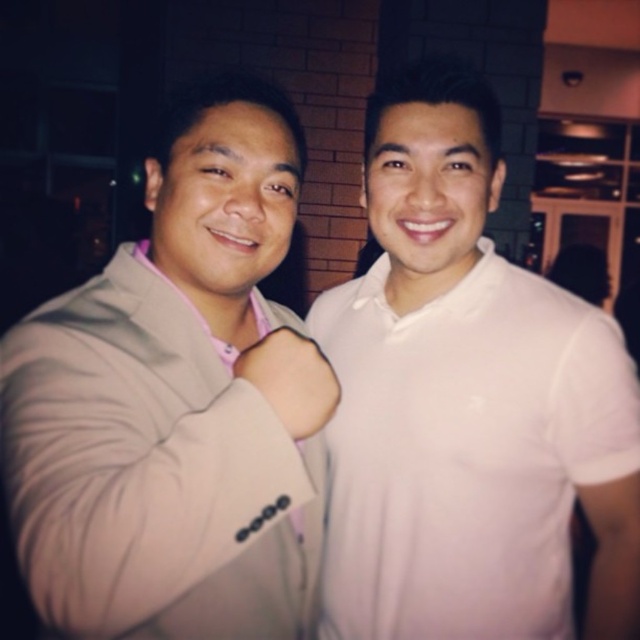
You are a photographer trying to capture both the beige fabric suit at left and the white cotton polo shirt at right in the same frame. Since you want to ensure both are fully visible, which clothing item requires more space horizontally in the frame?

The white cotton polo shirt at right requires more horizontal space in the frame because its width is greater than the beige fabric suit at left.

You are a photographer setting up for a group photo. You need to position the beige fabric suit at left and the white cotton polo shirt at right so that both are clearly visible. Considering their sizes, which clothing item should be placed closer to the camera to avoid blocking the other?

The beige fabric suit at left is larger in size than the white cotton polo shirt at right. To avoid blocking the smaller item, the white cotton polo shirt at right should be placed closer to the camera.

You are a photographer trying to capture the beige fabric suit at left and the white short sleeve shirt at right in a photo. The camera can only focus on objects within a 0.5 unit radius centered at point (177, 401). Will both the beige fabric suit at left and the white short sleeve shirt at right be within the focus area?

The point (177, 401) indicates the beige fabric suit at left. Since the focus area is a 0.5 unit radius around this point, the beige fabric suit at left will be within the focus area. However, the white short sleeve shirt at right is not mentioned in the objects description, so its distance from the point is unknown. Therefore, we cannot confirm if it will be within the focus area.